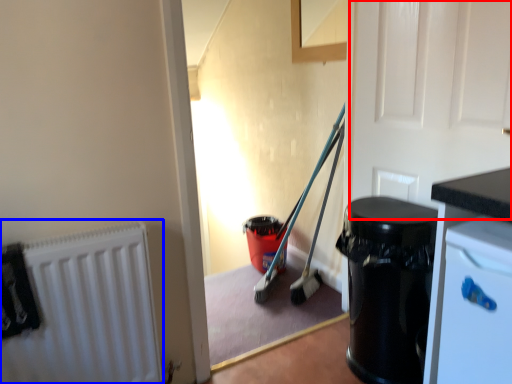
Question: Which object is closer to the camera taking this photo, door (highlighted by a red box) or radiator (highlighted by a blue box)?

Choices:
 (A) door
 (B) radiator

Answer: (A)